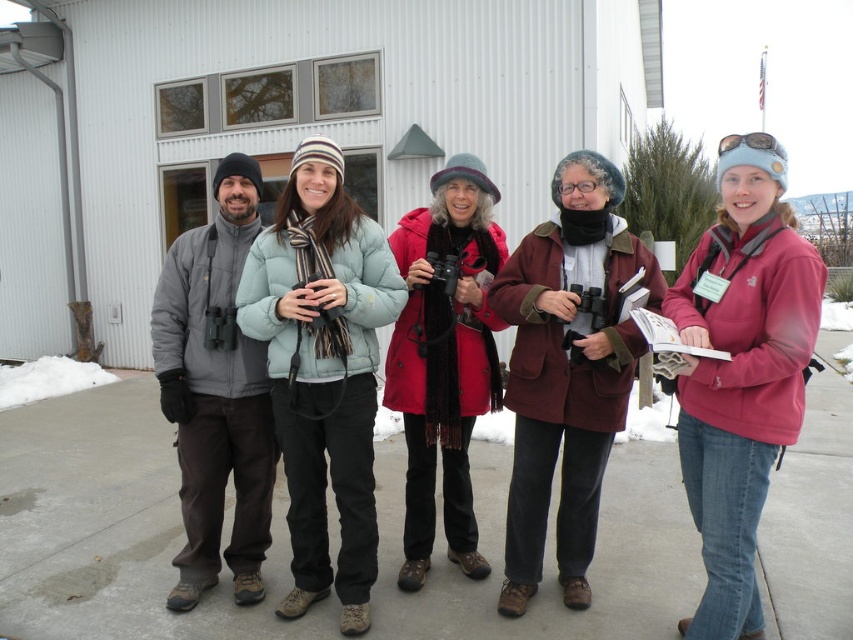
You are taking a photo of the group standing in front of the white building. You notice two points in the image labeled as point 1 at coordinates point 1 at coordinates point (786, 396) and point 2 at coordinates point (260, 584). Which point is closer to the camera?

Point (786, 396) is closer to the camera than point (260, 584).

You are a photographer trying to capture a group photo of the light blue down jacket at center and the maroon woolen coat at center. Which person should you position closer to the camera to ensure both are in focus?

The light blue down jacket at center is much taller than the maroon woolen coat at center, so you should position the maroon woolen coat at center closer to the camera to ensure both are in focus.